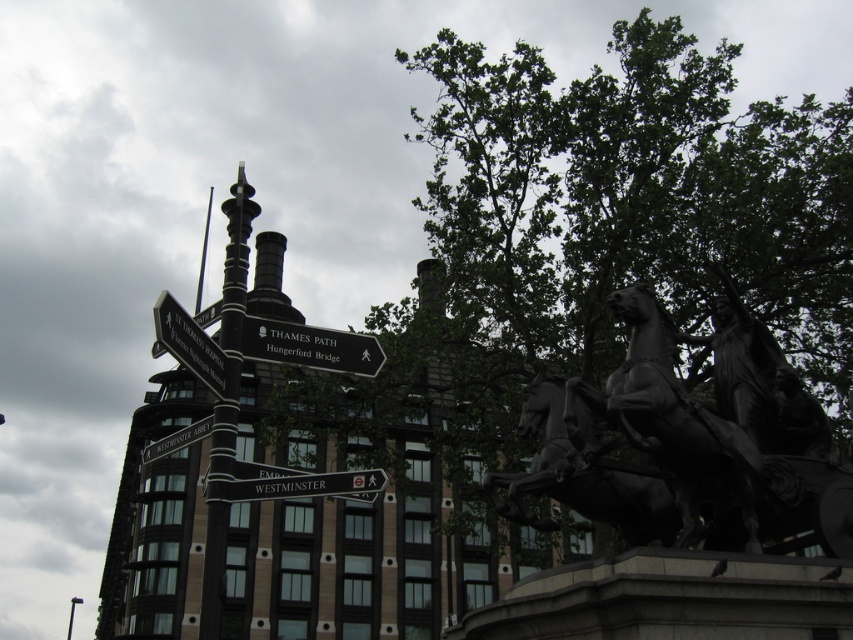
Question: Where is black plastic sign at center located in relation to black metal signpost at upper left in the image?

Choices:
 (A) right
 (B) left

Answer: (B)

Question: Which object appears closest to the camera in this image?

Choices:
 (A) bronze textured horse at center right
 (B) black metal sign at upper left

Answer: (A)

Question: Is black plastic sign at center to the right of black metal signpost at upper left from the viewer's perspective?

Choices:
 (A) no
 (B) yes

Answer: (A)

Question: Is polished bronze horse at center to the left of bronze textured horse at center right from the viewer's perspective?

Choices:
 (A) yes
 (B) no

Answer: (B)

Question: Which object is farther from the camera taking this photo?

Choices:
 (A) black metal signpost at upper left
 (B) bronze textured horse at center right

Answer: (B)

Question: Which of the following is the farthest from the observer?

Choices:
 (A) black plastic sign at upper center
 (B) black metal sign at upper left
 (C) bronze statue at center
 (D) bronze textured horse at center right

Answer: (B)